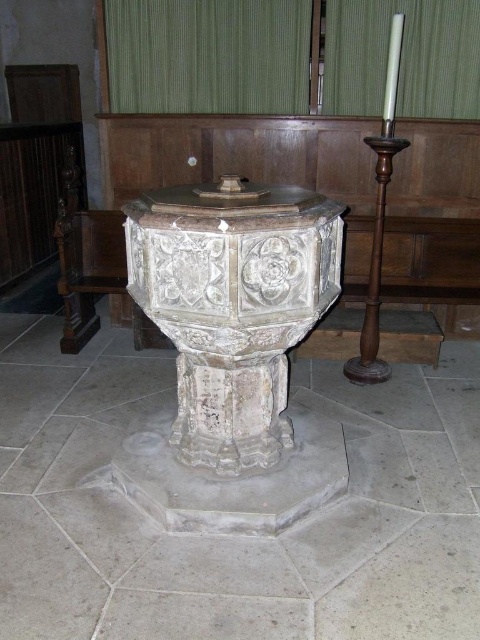
Question: Which of these objects is positioned farthest from the green fabric curtain at upper center?

Choices:
 (A) white stone baptismal font at center
 (B) carved stone baptismal font at center

Answer: (A)

Question: Does white stone baptismal font at center appear on the right side of carved stone baptismal font at center?

Choices:
 (A) yes
 (B) no

Answer: (A)

Question: Considering the relative positions of white stone baptismal font at center and green fabric curtain at upper center in the image provided, where is white stone baptismal font at center located with respect to green fabric curtain at upper center?

Choices:
 (A) above
 (B) below

Answer: (B)

Question: Which of the following is the closest to the observer?

Choices:
 (A) (288, 419)
 (B) (336, 70)
 (C) (129, 579)

Answer: (C)

Question: Is white stone baptismal font at center below carved stone baptismal font at center?

Choices:
 (A) yes
 (B) no

Answer: (A)

Question: Among these points, which one is farthest from the camera?

Choices:
 (A) (254, 74)
 (B) (327, 392)

Answer: (A)